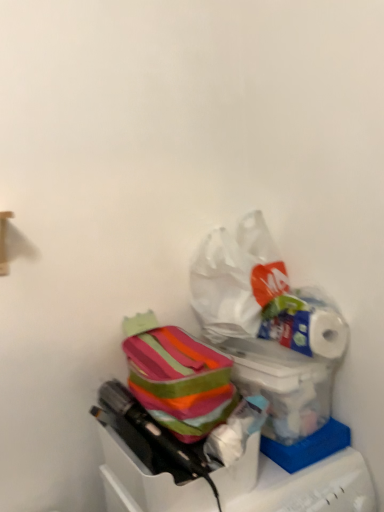
Question: Is white glossy toilet paper at upper right turned away from striped fabric bag at center, which is the 2th box in top-to-bottom order?

Choices:
 (A) no
 (B) yes

Answer: (A)

Question: Is white glossy toilet paper at upper right not close to striped fabric bag at center, which is the 1th box in bottom-to-top order?

Choices:
 (A) no
 (B) yes

Answer: (A)

Question: From a real-world perspective, is white glossy toilet paper at upper right over striped fabric bag at center, which is the 1th box in bottom-to-top order?

Choices:
 (A) no
 (B) yes

Answer: (B)

Question: From the image's perspective, is white glossy toilet paper at upper right over striped fabric bag at center, which is the 1th box in bottom-to-top order?

Choices:
 (A) yes
 (B) no

Answer: (A)

Question: Can you confirm if white glossy toilet paper at upper right is taller than striped fabric bag at center, which is the 1th box in bottom-to-top order?

Choices:
 (A) yes
 (B) no

Answer: (B)

Question: Does white glossy toilet paper at upper right have a smaller size compared to striped fabric bag at center, which is the 1th box in bottom-to-top order?

Choices:
 (A) yes
 (B) no

Answer: (A)

Question: Does translucent plastic bag at lower right, the 2th box when ordered from bottom to top, have a larger size compared to striped fabric bag at center, which is the 1th box in bottom-to-top order?

Choices:
 (A) no
 (B) yes

Answer: (A)

Question: Is translucent plastic bag at lower right, the 1th box in the top-to-bottom sequence, shorter than striped fabric bag at center, which is the 2th box in top-to-bottom order?

Choices:
 (A) yes
 (B) no

Answer: (B)

Question: Can striped fabric bag at center, which is the 2th box in top-to-bottom order, be found inside translucent plastic bag at lower right, the 2th box when ordered from bottom to top?

Choices:
 (A) no
 (B) yes

Answer: (A)

Question: Are translucent plastic bag at lower right, the 2th box when ordered from bottom to top, and striped fabric bag at center, which is the 1th box in bottom-to-top order, making contact?

Choices:
 (A) yes
 (B) no

Answer: (B)

Question: Considering the relative sizes of translucent plastic bag at lower right, the 2th box when ordered from bottom to top, and striped fabric bag at center, which is the 2th box in top-to-bottom order, in the image provided, is translucent plastic bag at lower right, the 2th box when ordered from bottom to top, smaller than striped fabric bag at center, which is the 2th box in top-to-bottom order,?

Choices:
 (A) no
 (B) yes

Answer: (B)

Question: Does translucent plastic bag at lower right, the 2th box when ordered from bottom to top, have a lesser width compared to striped fabric bag at center, which is the 2th box in top-to-bottom order?

Choices:
 (A) yes
 (B) no

Answer: (A)

Question: From a real-world perspective, is striped fabric lunchbox at center under white glossy toilet paper at upper right?

Choices:
 (A) yes
 (B) no

Answer: (A)